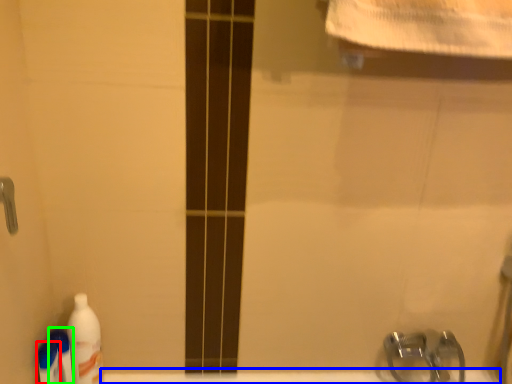
Question: Considering the real-world distances, which object is farthest from cleaning product (highlighted by a red box)? bath (highlighted by a blue box) or cleaning product (highlighted by a green box)?

Choices:
 (A) bath
 (B) cleaning product

Answer: (A)